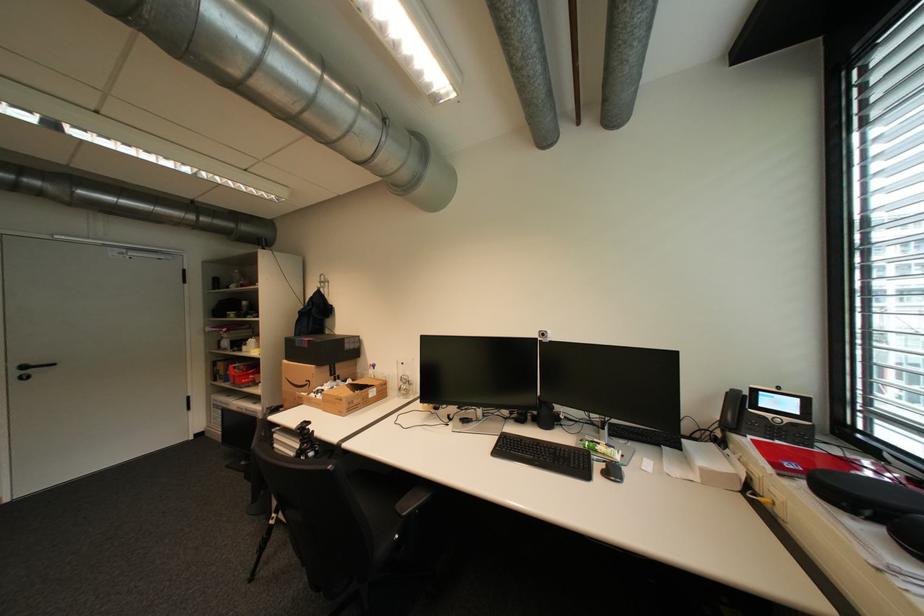
The width and height of the screenshot is (924, 616). I want to click on blue backpack, so click(x=312, y=315).